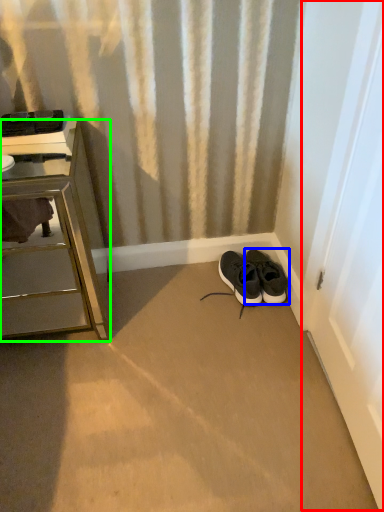
Question: Which is nearer to the screen door (highlighted by a red box)? footwear (highlighted by a blue box) or chest of drawers (highlighted by a green box).

Choices:
 (A) footwear
 (B) chest of drawers

Answer: (A)